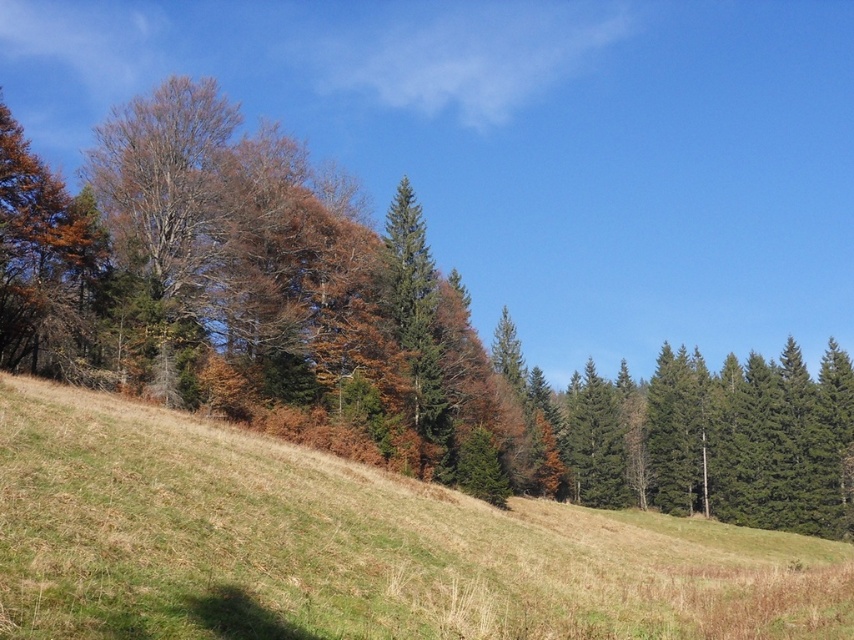
Does point (420, 241) come behind point (363, 516)?

Yes, point (420, 241) is behind point (363, 516).

Which is in front, point (331, 246) or point (542, 616)?

Positioned in front is point (542, 616).

This screenshot has width=854, height=640. What do you see at coordinates (373, 333) in the screenshot? I see `brown matte tree at left` at bounding box center [373, 333].

Locate an element on the screen. brown matte tree at left is located at coordinates (373, 333).